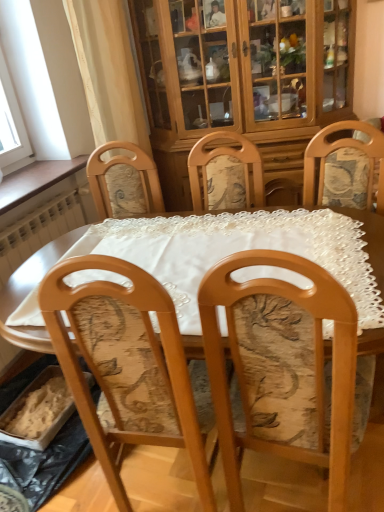
Question: From their relative heights in the image, would you say wooden chair with floral upholstery at center is taller or shorter than wooden cabinet at upper center?

Choices:
 (A) short
 (B) tall

Answer: (A)

Question: Based on their sizes in the image, would you say wooden chair with floral upholstery at center is bigger or smaller than wooden cabinet at upper center?

Choices:
 (A) small
 (B) big

Answer: (A)

Question: Which object is the closest to the wooden chair with floral upholstery at center?

Choices:
 (A) wooden cabinet at upper center
 (B) wooden table at center

Answer: (B)

Question: Estimate the real-world distances between objects in this image. Which object is farther from the wooden cabinet at upper center?

Choices:
 (A) wooden chair with floral upholstery at center
 (B) wooden table at center

Answer: (A)